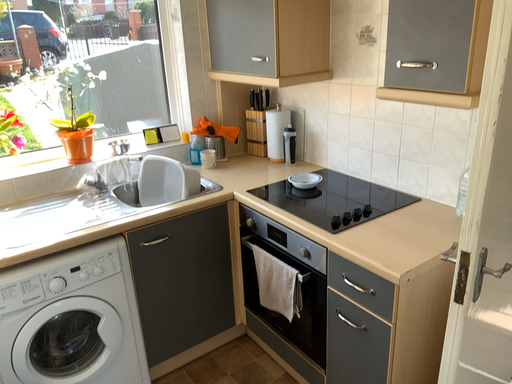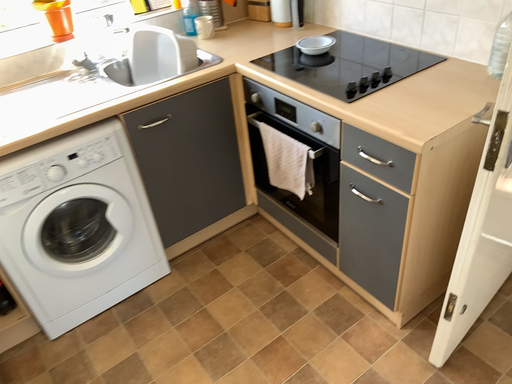
Question: How did the camera likely rotate when shooting the video?

Choices:
 (A) rotated downward
 (B) rotated upward

Answer: (A)